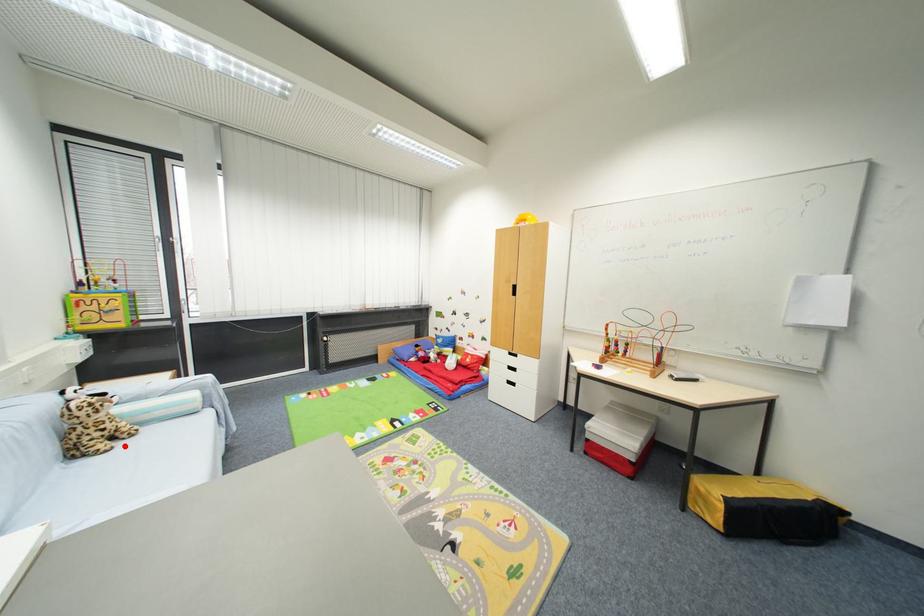
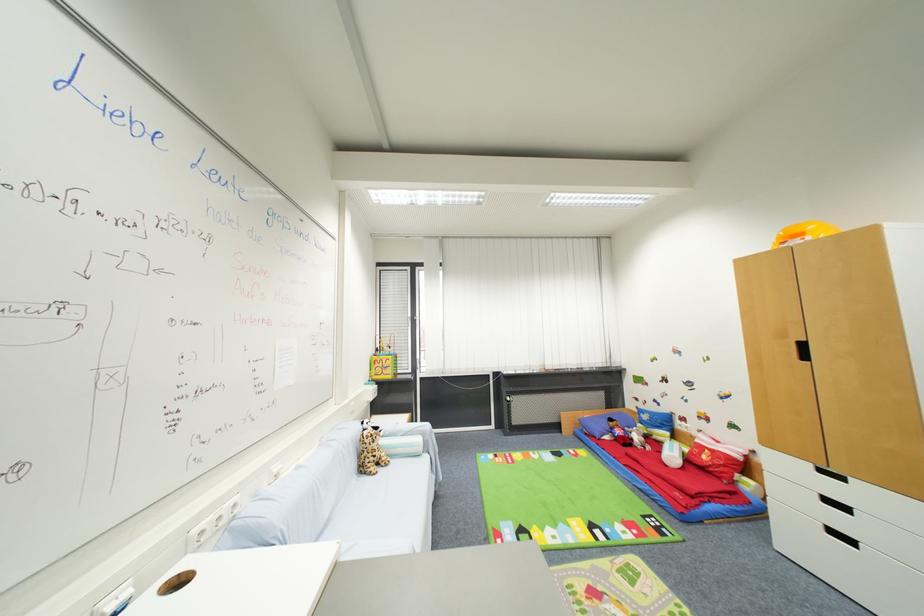
Question: I am providing you with two images of the same scene from different viewpoints. In image1, a red point is highlighted. Considering the same 3D point in image2, which of the following is correct?

Choices:
 (A) It is closer
 (B) It is farther

Answer: (B)